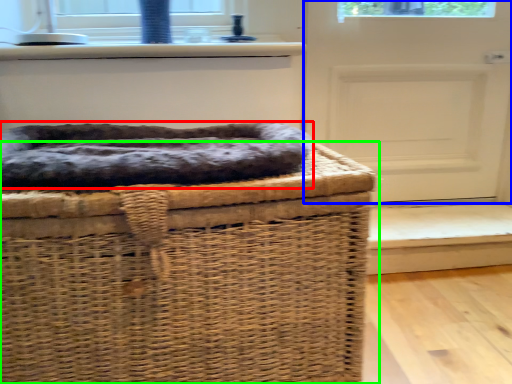
Question: Based on their relative distances, which object is farther from dog bed (highlighted by a red box)? Choose from door (highlighted by a blue box) and furniture (highlighted by a green box).

Choices:
 (A) door
 (B) furniture

Answer: (A)